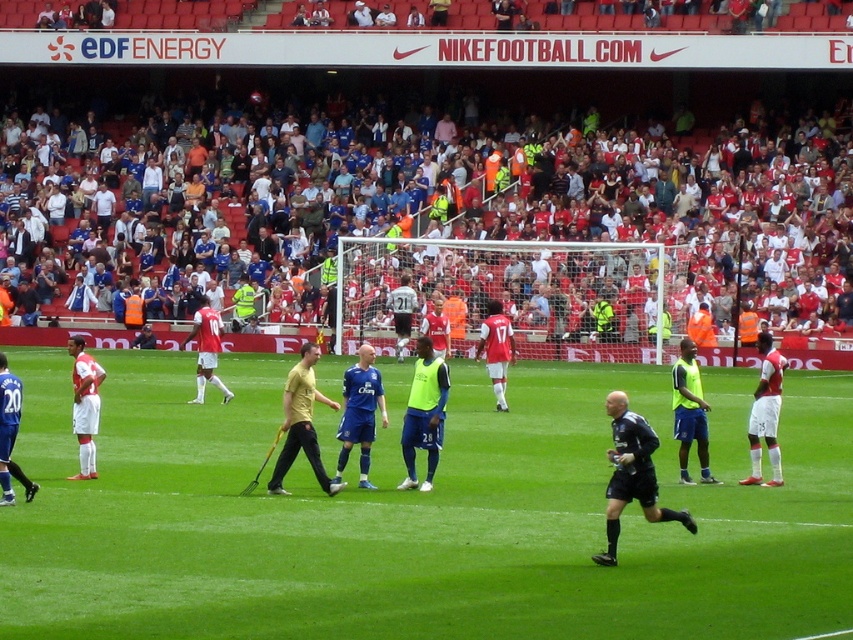
Question: Does red fabric crowd at upper center appear over matte red jersey at center?

Choices:
 (A) yes
 (B) no

Answer: (A)

Question: Does neon yellow vest at center have a smaller size compared to white matte shorts at left?

Choices:
 (A) no
 (B) yes

Answer: (B)

Question: Which object appears closest to the camera in this image?

Choices:
 (A) white matte shorts at right
 (B) neon green vest at center
 (C) white matte shorts at left
 (D) red fabric crowd at upper center

Answer: (B)

Question: Can you confirm if white matte shorts at right is wider than matte red jersey at center?

Choices:
 (A) yes
 (B) no

Answer: (A)

Question: Which is farther from the neon yellow vest at center?

Choices:
 (A) white matte shorts at left
 (B) neon green vest at center
 (C) white jersey at center
 (D) blue jersey at center

Answer: (C)

Question: Which point is farther from the camera taking this photo?

Choices:
 (A) (199, 348)
 (B) (85, 472)

Answer: (A)